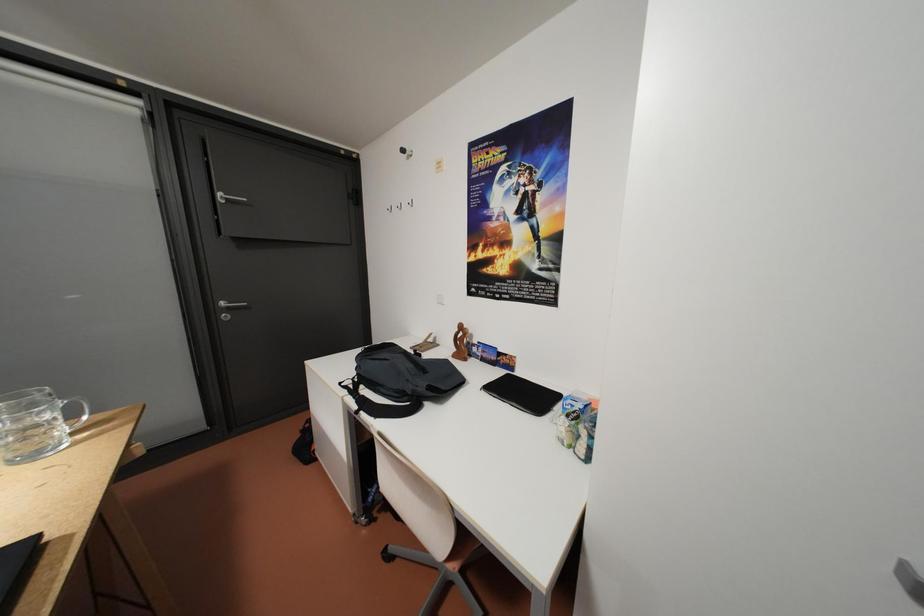
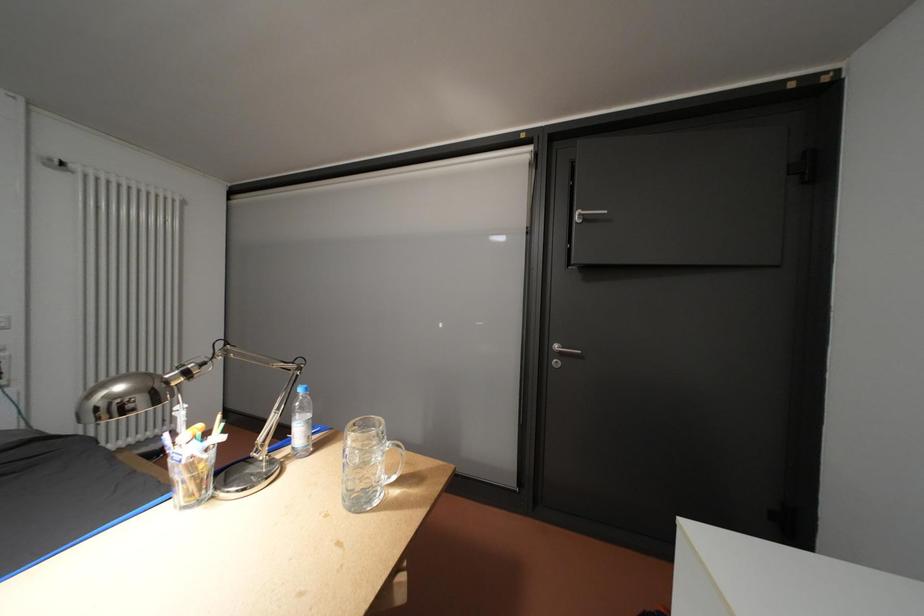
Question: How did the camera likely rotate?

Choices:
 (A) Left
 (B) Right
 (C) Up
 (D) Down

Answer: (A)